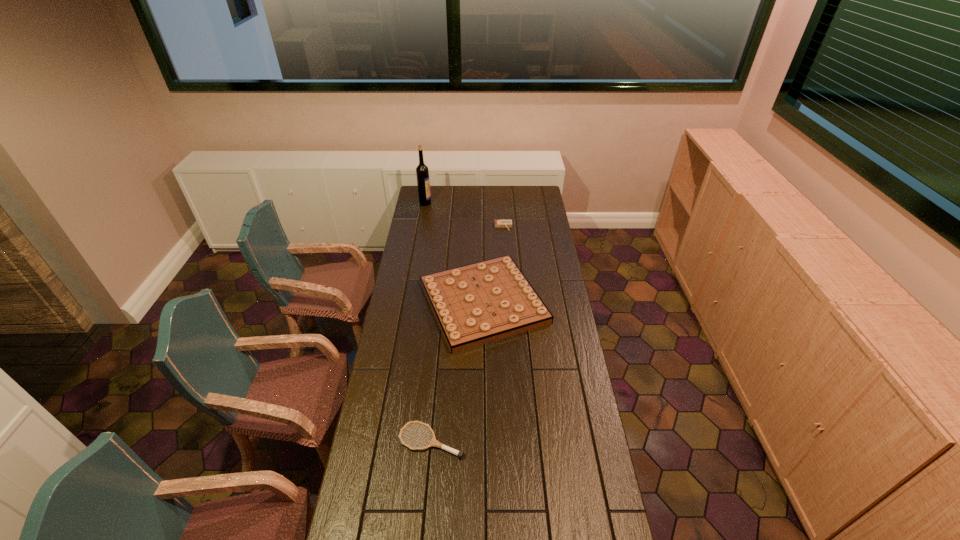
You are a GUI agent. You are given a task and a screenshot of the screen. Output one action in this format:
    pyautogui.click(x=<x>, y=<y>)
    Task: Click on the free spot between the wine bottle and the gameboard
    
    Given the screenshot: What is the action you would take?
    pyautogui.click(x=454, y=253)

Find the location of a particular element. The width and height of the screenshot is (960, 540). object that is the second closest to the farthest object is located at coordinates (475, 304).

Identify which object is the closest to the second farthest object. Please provide its 2D coordinates. Your answer should be formatted as a tuple, i.e. [(x, y)], where the tuple contains the x and y coordinates of a point satisfying the conditions above.

[(475, 304)]

In order to click on vacant space that satisfies the following two spatial constraints: 1. on the label of the farthest object; 2. on the right side of the tennis racket in this screenshot , I will do `click(383, 441)`.